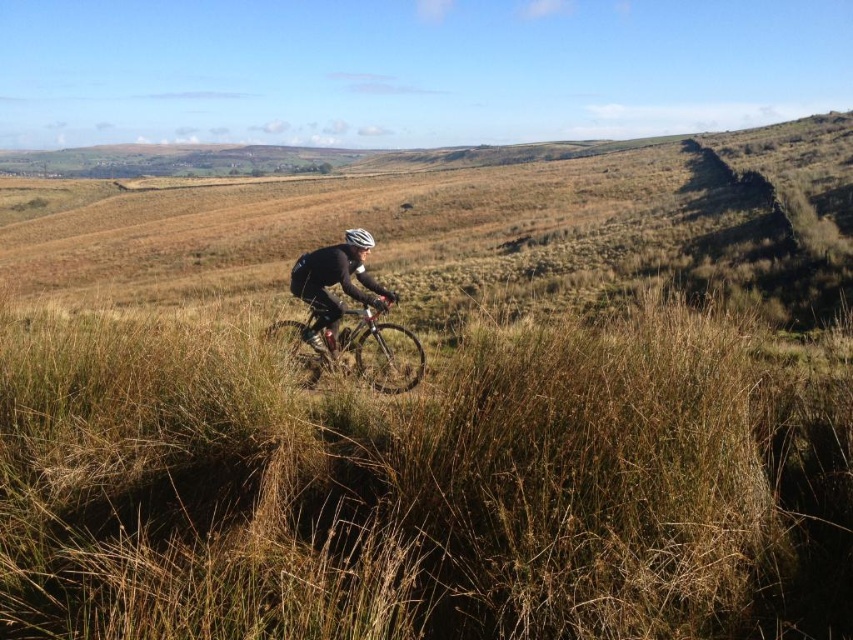
You are a drone operator trying to capture the cyclist in the image. The cyclist is moving towards the point at coordinates (x=424, y=486). What will the drone see when it reaches that point?

The drone will see brown dry grass at center when it reaches the point at coordinates (x=424, y=486).

You are a hiker who wants to take a photo of the silver metallic mountain bike at center and the black matte jacket at center. To ensure both are in frame, should you adjust your camera to focus more on the left or the right side?

You should focus more on the left side because the silver metallic mountain bike at center is to the left of the black matte jacket at center.

You are a photographer trying to capture the silver metallic mountain bike at center in your shot. However, you notice that the brown dry grass at center is blocking part of the bike. Based on the scene, can you determine if the grass is closer to you than the bike?

The brown dry grass at center is closer to the viewer than the silver metallic mountain bike at center, so yes, the grass is blocking part of the bike because it is in front of it.